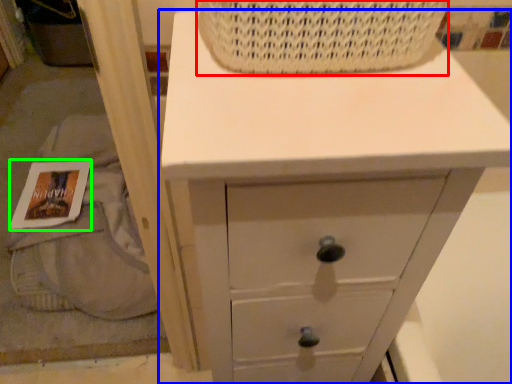
Question: Which object is the closest to the basket (highlighted by a red box)? Choose among these: chest of drawers (highlighted by a blue box) or magazine (highlighted by a green box).

Choices:
 (A) chest of drawers
 (B) magazine

Answer: (A)